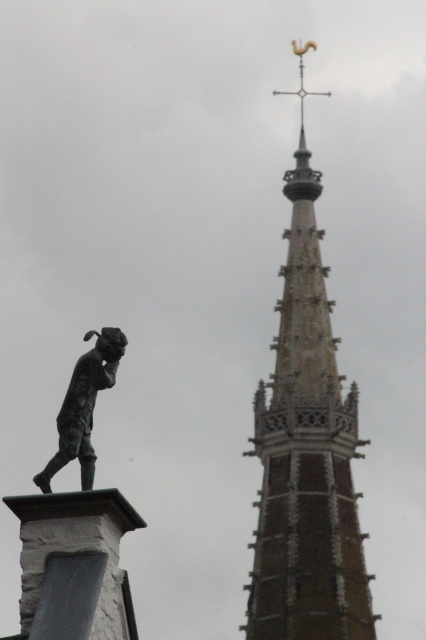
How much distance is there between brown stone spire at upper center and bronze statue at left?

brown stone spire at upper center and bronze statue at left are 193.17 feet apart.

Does point (333, 468) come closer to viewer compared to point (89, 436)?

No, it is not.

What do you see at coordinates (307, 451) in the screenshot? The image size is (426, 640). I see `brown stone spire at upper center` at bounding box center [307, 451].

At what (x,y) coordinates should I click in order to perform the action: click on brown stone spire at upper center. Please return your answer as a coordinate pair (x, y). Image resolution: width=426 pixels, height=640 pixels. Looking at the image, I should click on (307, 451).